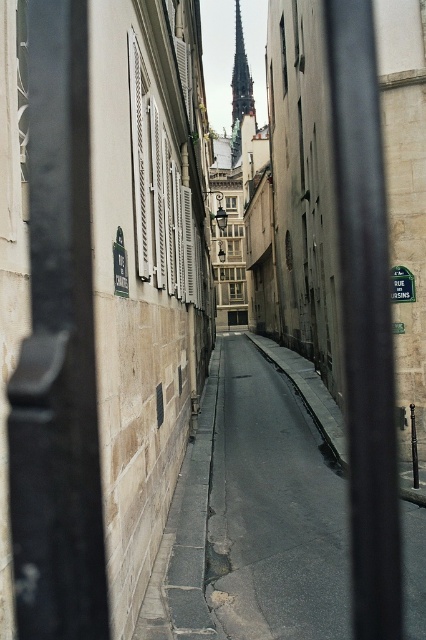
Can you confirm if smooth gray stone spire at upper center is shorter than green plastic street sign at center?

No, smooth gray stone spire at upper center is not shorter than green plastic street sign at center.

Does smooth gray stone spire at upper center appear under green plastic street sign at center?

Actually, smooth gray stone spire at upper center is above green plastic street sign at center.

Does point (241, 97) come farther from viewer compared to point (402, 268)?

Yes, it is behind point (402, 268).

Where is `smooth gray stone spire at upper center`? This screenshot has width=426, height=640. smooth gray stone spire at upper center is located at coordinates (241, 77).

Which is more to the right, smooth asphalt road at center or smooth gray stone spire at upper center?

From the viewer's perspective, smooth gray stone spire at upper center appears more on the right side.

Describe the element at coordinates (273, 509) in the screenshot. I see `smooth asphalt road at center` at that location.

Where is `smooth asphalt road at center`? The width and height of the screenshot is (426, 640). smooth asphalt road at center is located at coordinates (273, 509).

Is smooth asphalt road at center smaller than green plastic street sign at center?

No, smooth asphalt road at center is not smaller than green plastic street sign at center.

How far apart are smooth asphalt road at center and green plastic street sign at center?

3.31 meters

Is point (298, 497) farther from viewer compared to point (400, 301)?

No, (298, 497) is closer to viewer.

I want to click on smooth asphalt road at center, so click(273, 509).